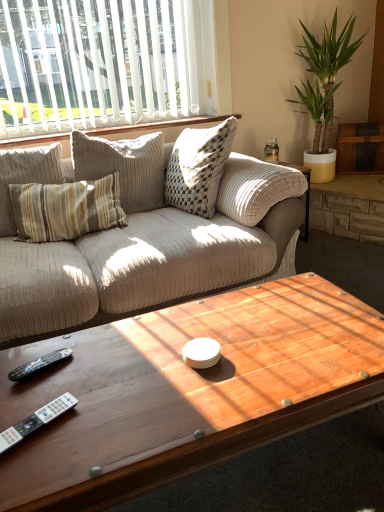
Where is `free spot to the right of black plastic remote at lower left`? Image resolution: width=384 pixels, height=512 pixels. free spot to the right of black plastic remote at lower left is located at coordinates (97, 366).